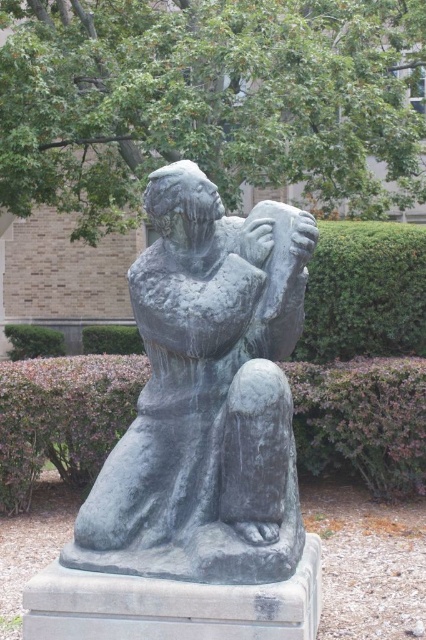
Question: Which point is farther to the camera?

Choices:
 (A) bronze statue at center
 (B) purple shrubbery at lower center
 (C) green leafy tree at upper center

Answer: (C)

Question: Which point appears closest to the camera in this image?

Choices:
 (A) (66, 188)
 (B) (140, 316)

Answer: (B)

Question: Where is green leafy tree at upper center located in relation to bronze statue at center in the image?

Choices:
 (A) below
 (B) above

Answer: (B)

Question: Does green leafy tree at upper center appear on the right side of bronze statue at center?

Choices:
 (A) no
 (B) yes

Answer: (A)

Question: Does bronze statue at center appear on the right side of purple shrubbery at lower center?

Choices:
 (A) no
 (B) yes

Answer: (B)

Question: Which object is farther from the camera taking this photo?

Choices:
 (A) green leafy tree at upper center
 (B) bronze statue at center
 (C) purple shrubbery at lower center

Answer: (A)